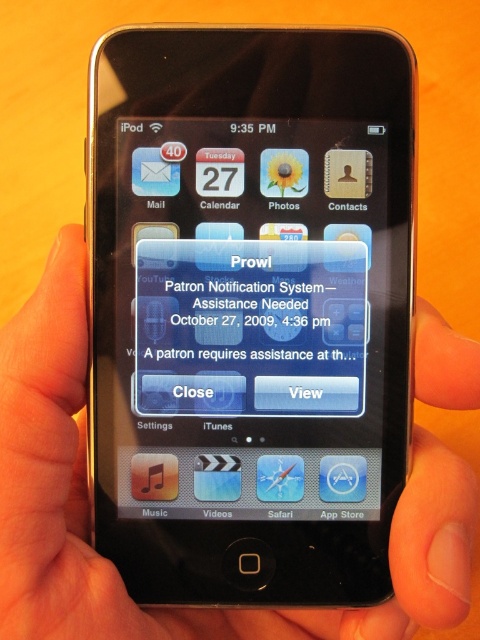
Question: Can you confirm if black matte hand at center is smaller than white matte text message at center?

Choices:
 (A) no
 (B) yes

Answer: (A)

Question: Is black matte hand at center further to the viewer compared to white matte text message at center?

Choices:
 (A) yes
 (B) no

Answer: (B)

Question: Is black matte hand at center thinner than white matte text message at center?

Choices:
 (A) no
 (B) yes

Answer: (A)

Question: Among these points, which one is nearest to the camera?

Choices:
 (A) (321, 397)
 (B) (84, 344)

Answer: (B)